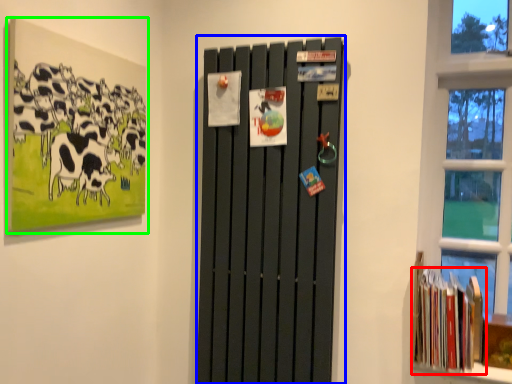
Question: Which is nearer to the book (highlighted by a red box)? barn door (highlighted by a blue box) or picture frame (highlighted by a green box).

Choices:
 (A) barn door
 (B) picture frame

Answer: (A)